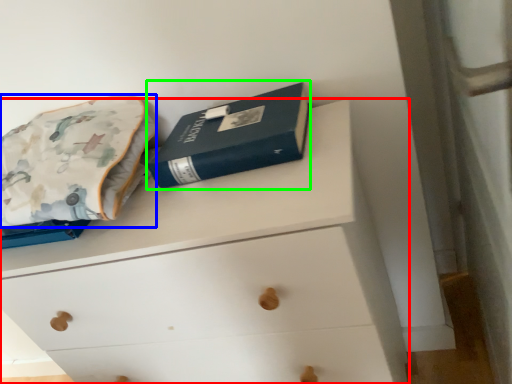
Question: Considering the real-world distances, which object is closest to chest of drawers (highlighted by a red box)? throw pillow (highlighted by a blue box) or paperback book (highlighted by a green box).

Choices:
 (A) throw pillow
 (B) paperback book

Answer: (B)